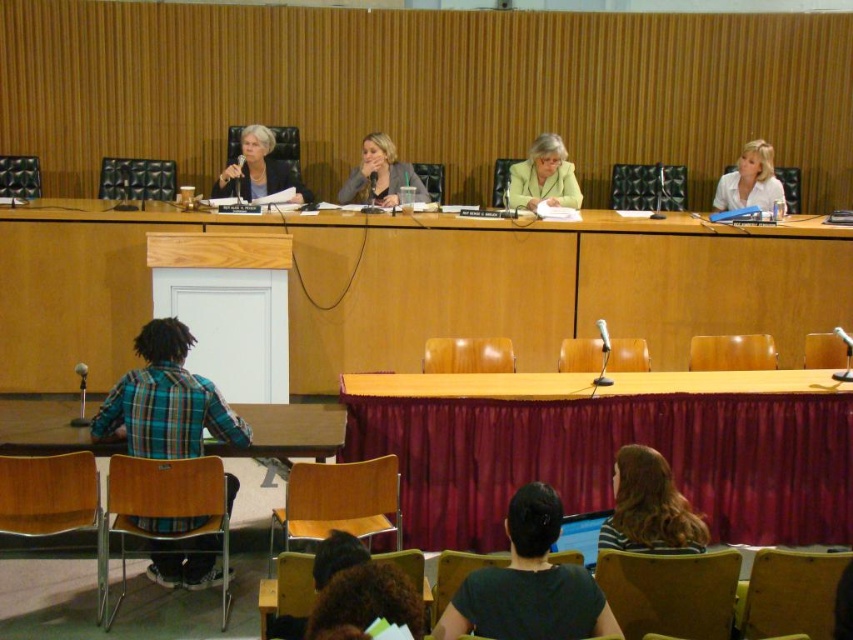
Is wooden table at center to the left of white matte shirt at upper right from the viewer's perspective?

Indeed, wooden table at center is positioned on the left side of white matte shirt at upper right.

Which of these two, wooden table at center or white matte shirt at upper right, stands taller?

wooden table at center

At what (x,y) coordinates should I click in order to perform the action: click on wooden table at center. Please return your answer as a coordinate pair (x, y). The width and height of the screenshot is (853, 640). Looking at the image, I should click on (608, 448).

Where is `wooden table at center`? wooden table at center is located at coordinates (608, 448).

Does striped fabric shirt at lower center appear on the left side of matte gray blazer at center?

In fact, striped fabric shirt at lower center is to the right of matte gray blazer at center.

You are a GUI agent. You are given a task and a screenshot of the screen. Output one action in this format:
    pyautogui.click(x=<x>, y=<y>)
    Task: Click on the striped fabric shirt at lower center
    This screenshot has height=640, width=853.
    Given the screenshot: What is the action you would take?
    pyautogui.click(x=648, y=508)

Is wooden at center shorter than matte yellow jacket at center?

No.

Is the position of wooden at center less distant than that of matte yellow jacket at center?

Yes.

Is point (567, 268) in front of point (563, 204)?

Yes, point (567, 268) is in front of point (563, 204).

At what (x,y) coordinates should I click in order to perform the action: click on wooden at center. Please return your answer as a coordinate pair (x, y). Looking at the image, I should click on (421, 285).